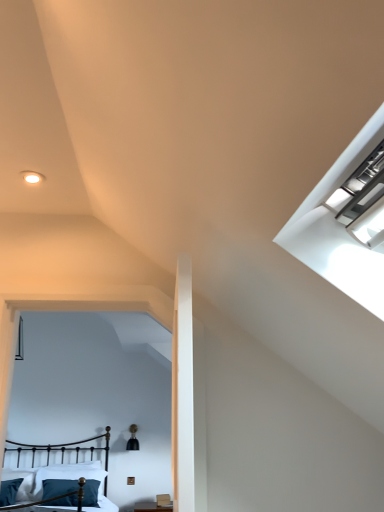
Question: From a real-world perspective, is teal velvet pillow at lower left, the first pillow viewed from the left, physically below black wrought iron bed at lower left?

Choices:
 (A) no
 (B) yes

Answer: (B)

Question: Is teal velvet pillow at lower left, the second pillow viewed from the right, looking in the opposite direction of black wrought iron bed at lower left?

Choices:
 (A) yes
 (B) no

Answer: (A)

Question: Does teal velvet pillow at lower left, the first pillow viewed from the left, touch black wrought iron bed at lower left?

Choices:
 (A) yes
 (B) no

Answer: (B)

Question: Considering the relative sizes of teal velvet pillow at lower left, the second pillow viewed from the right, and black wrought iron bed at lower left in the image provided, is teal velvet pillow at lower left, the second pillow viewed from the right, thinner than black wrought iron bed at lower left?

Choices:
 (A) yes
 (B) no

Answer: (A)

Question: Could you tell me if teal velvet pillow at lower left, the second pillow viewed from the right, is facing black wrought iron bed at lower left?

Choices:
 (A) no
 (B) yes

Answer: (B)

Question: Is teal velvet pillow at lower left, the second pillow viewed from the right, outside black wrought iron bed at lower left?

Choices:
 (A) yes
 (B) no

Answer: (B)

Question: Could you tell me if teal fabric pillow at lower left, which is the 1th pillow in right-to-left order, is turned towards teal velvet pillow at lower left, the first pillow viewed from the left?

Choices:
 (A) yes
 (B) no

Answer: (B)

Question: Is teal fabric pillow at lower left, acting as the 2th pillow starting from the left, at the left side of teal velvet pillow at lower left, the first pillow viewed from the left?

Choices:
 (A) no
 (B) yes

Answer: (A)

Question: Considering the relative sizes of teal fabric pillow at lower left, acting as the 2th pillow starting from the left, and teal velvet pillow at lower left, the first pillow viewed from the left, in the image provided, is teal fabric pillow at lower left, acting as the 2th pillow starting from the left, bigger than teal velvet pillow at lower left, the first pillow viewed from the left,?

Choices:
 (A) no
 (B) yes

Answer: (B)

Question: Is the position of teal fabric pillow at lower left, acting as the 2th pillow starting from the left, more distant than that of teal velvet pillow at lower left, the second pillow viewed from the right?

Choices:
 (A) yes
 (B) no

Answer: (A)

Question: Does teal fabric pillow at lower left, acting as the 2th pillow starting from the left, come in front of teal velvet pillow at lower left, the first pillow viewed from the left?

Choices:
 (A) no
 (B) yes

Answer: (A)

Question: Are teal fabric pillow at lower left, acting as the 2th pillow starting from the left, and teal velvet pillow at lower left, the first pillow viewed from the left, far apart?

Choices:
 (A) no
 (B) yes

Answer: (A)

Question: From the image's perspective, is teal fabric pillow at lower left, which is the 1th pillow in right-to-left order, on top of black wrought iron bed at lower left?

Choices:
 (A) yes
 (B) no

Answer: (B)